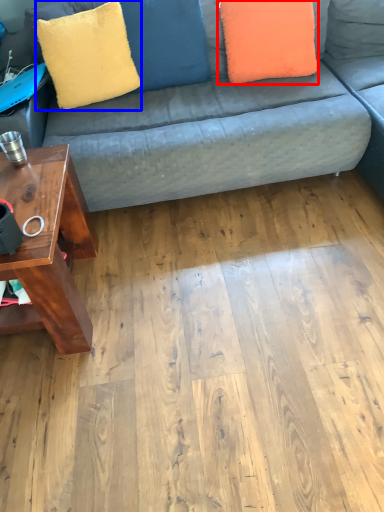
Question: Which object appears closest to the camera in this image, pillow (highlighted by a red box) or throw pillow (highlighted by a blue box)?

Choices:
 (A) pillow
 (B) throw pillow

Answer: (B)